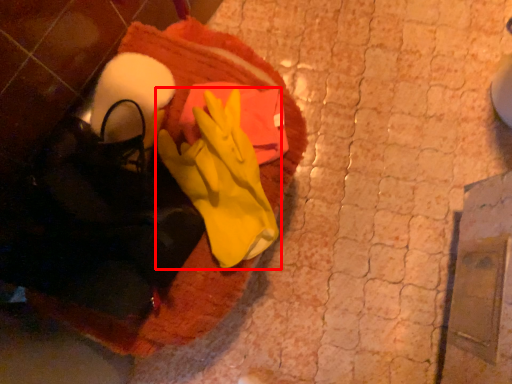
Question: From the image's perspective, what is the correct spatial relationship of glove (annotated by the red box) in relation to blanket?

Choices:
 (A) above
 (B) below

Answer: (A)